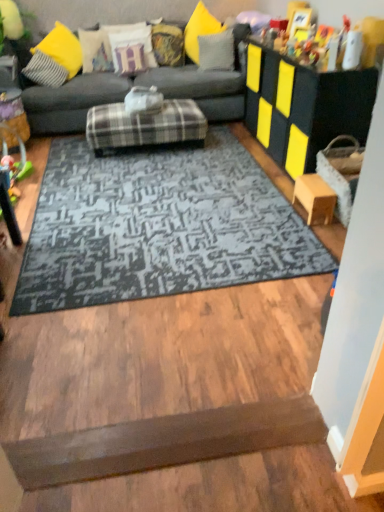
Question: Is yellow fabric pillow at upper center, the fifth pillow when ordered from left to right, bigger than wooden stool at lower right?

Choices:
 (A) no
 (B) yes

Answer: (B)

Question: Can you confirm if yellow fabric pillow at upper center, which ranks as the second pillow in right-to-left order, is wider than wooden stool at lower right?

Choices:
 (A) no
 (B) yes

Answer: (B)

Question: Is yellow fabric pillow at upper center, the fifth pillow when ordered from left to right, positioned in front of wooden stool at lower right?

Choices:
 (A) no
 (B) yes

Answer: (A)

Question: Is yellow fabric pillow at upper center, the fifth pillow when ordered from left to right, touching wooden stool at lower right?

Choices:
 (A) yes
 (B) no

Answer: (B)

Question: Can you confirm if yellow fabric pillow at upper center, the fifth pillow when ordered from left to right, is thinner than wooden stool at lower right?

Choices:
 (A) yes
 (B) no

Answer: (B)

Question: From the image's perspective, is yellow fabric pillow at upper center, the fifth pillow when ordered from left to right, below wooden stool at lower right?

Choices:
 (A) yes
 (B) no

Answer: (B)

Question: Is plastic green toy at left further to camera compared to textured fabric pillow at upper center, positioned as the fourth pillow in left-to-right order?

Choices:
 (A) yes
 (B) no

Answer: (B)

Question: Considering the relative sizes of plastic green toy at left and textured fabric pillow at upper center, the 3th pillow in the right-to-left sequence, in the image provided, is plastic green toy at left bigger than textured fabric pillow at upper center, the 3th pillow in the right-to-left sequence,?

Choices:
 (A) yes
 (B) no

Answer: (A)

Question: Can you confirm if plastic green toy at left is taller than textured fabric pillow at upper center, positioned as the fourth pillow in left-to-right order?

Choices:
 (A) no
 (B) yes

Answer: (B)

Question: Can you confirm if plastic green toy at left is smaller than textured fabric pillow at upper center, the 3th pillow in the right-to-left sequence?

Choices:
 (A) no
 (B) yes

Answer: (A)

Question: From the image's perspective, is plastic green toy at left over textured fabric pillow at upper center, positioned as the fourth pillow in left-to-right order?

Choices:
 (A) yes
 (B) no

Answer: (B)

Question: Is plastic green toy at left completely or partially outside of textured fabric pillow at upper center, positioned as the fourth pillow in left-to-right order?

Choices:
 (A) no
 (B) yes

Answer: (B)

Question: Is brown matte doormat at lower center facing away from plastic green toy at left?

Choices:
 (A) no
 (B) yes

Answer: (A)